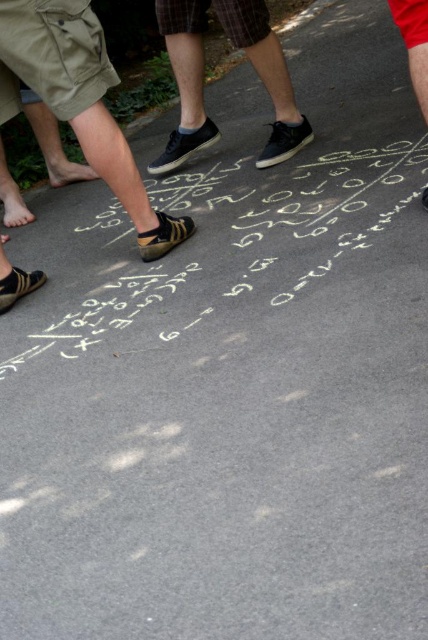
Question: Which object appears farthest from the camera in this image?

Choices:
 (A) leather shoe at center
 (B) white chalk math equations at center
 (C) matte black shoes at center

Answer: (C)

Question: Is white chalk math equations at center to the right of matte black shoes at center from the viewer's perspective?

Choices:
 (A) no
 (B) yes

Answer: (A)

Question: Can you confirm if white chalk math equations at center is bigger than matte black shoes at center?

Choices:
 (A) no
 (B) yes

Answer: (B)

Question: Which of the following is the closest to the observer?

Choices:
 (A) (165, 230)
 (B) (83, 246)

Answer: (A)

Question: Which object appears farthest from the camera in this image?

Choices:
 (A) leather shoe at center
 (B) white chalk math equations at center
 (C) matte black shoes at center

Answer: (C)

Question: Can you confirm if white chalk math equations at center is smaller than leather shoe at center?

Choices:
 (A) yes
 (B) no

Answer: (B)